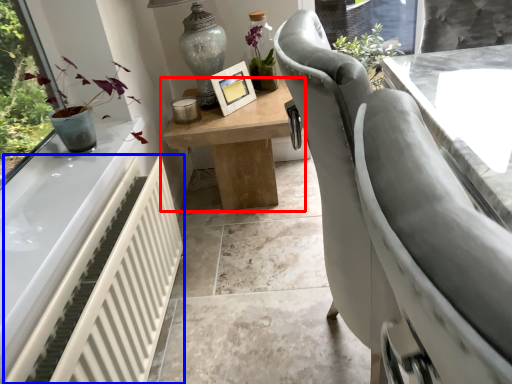
Question: Which object is closer to the camera taking this photo, table (highlighted by a red box) or radiator (highlighted by a blue box)?

Choices:
 (A) table
 (B) radiator

Answer: (B)